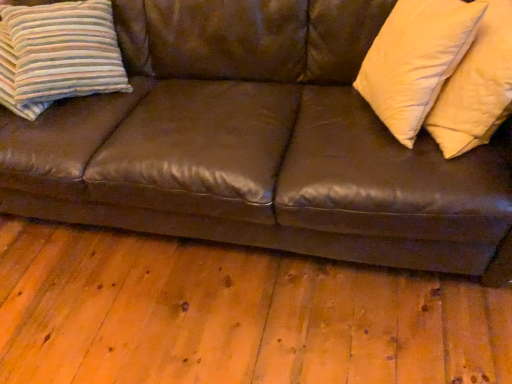
Question: Is soft yellow pillow at right, the third pillow from the left, positioned in front of striped fabric pillow at left, which ranks as the 1th pillow in left-to-right order?

Choices:
 (A) no
 (B) yes

Answer: (B)

Question: Is soft yellow pillow at right, which is counted as the 1th pillow, starting from the right, at the right side of striped fabric pillow at left, acting as the third pillow starting from the right?

Choices:
 (A) no
 (B) yes

Answer: (B)

Question: Considering the relative sizes of soft yellow pillow at right, which is counted as the 1th pillow, starting from the right, and striped fabric pillow at left, which ranks as the 1th pillow in left-to-right order, in the image provided, is soft yellow pillow at right, which is counted as the 1th pillow, starting from the right, wider than striped fabric pillow at left, which ranks as the 1th pillow in left-to-right order,?

Choices:
 (A) no
 (B) yes

Answer: (A)

Question: Is soft yellow pillow at right, the third pillow from the left, smaller than striped fabric pillow at left, acting as the third pillow starting from the right?

Choices:
 (A) yes
 (B) no

Answer: (B)

Question: Considering the relative positions of soft yellow pillow at right, which is counted as the 1th pillow, starting from the right, and striped fabric pillow at left, which ranks as the 1th pillow in left-to-right order, in the image provided, is soft yellow pillow at right, which is counted as the 1th pillow, starting from the right, to the left of striped fabric pillow at left, which ranks as the 1th pillow in left-to-right order, from the viewer's perspective?

Choices:
 (A) no
 (B) yes

Answer: (A)

Question: From the image's perspective, is soft cream pillow at right, placed as the second pillow when sorted from right to left, located above or below striped fabric pillow at left, acting as the third pillow starting from the right?

Choices:
 (A) above
 (B) below

Answer: (B)

Question: From a real-world perspective, is soft cream pillow at right, placed as the second pillow when sorted from right to left, positioned above or below striped fabric pillow at left, acting as the third pillow starting from the right?

Choices:
 (A) above
 (B) below

Answer: (A)

Question: Does point click(375, 102) appear closer or farther from the camera than point click(31, 109)?

Choices:
 (A) closer
 (B) farther

Answer: (A)

Question: In the image, is soft cream pillow at right, placed as the second pillow when sorted from right to left, on the left side or the right side of striped fabric pillow at left, acting as the third pillow starting from the right?

Choices:
 (A) right
 (B) left

Answer: (A)

Question: Is soft yellow pillow at right, which is counted as the 1th pillow, starting from the right, in front of or behind soft cream pillow at right, which is the second pillow in left-to-right order, in the image?

Choices:
 (A) front
 (B) behind

Answer: (A)

Question: From the image's perspective, is soft yellow pillow at right, which is counted as the 1th pillow, starting from the right, positioned above or below soft cream pillow at right, placed as the second pillow when sorted from right to left?

Choices:
 (A) above
 (B) below

Answer: (B)

Question: Considering the positions of soft yellow pillow at right, the third pillow from the left, and soft cream pillow at right, placed as the second pillow when sorted from right to left, in the image, is soft yellow pillow at right, the third pillow from the left, taller or shorter than soft cream pillow at right, placed as the second pillow when sorted from right to left,?

Choices:
 (A) short
 (B) tall

Answer: (B)

Question: Is soft yellow pillow at right, the third pillow from the left, bigger or smaller than soft cream pillow at right, placed as the second pillow when sorted from right to left?

Choices:
 (A) big
 (B) small

Answer: (A)

Question: Is striped fabric pillow at left, acting as the third pillow starting from the right, wider or thinner than brown leather couch at center?

Choices:
 (A) thin
 (B) wide

Answer: (A)

Question: Visually, is striped fabric pillow at left, acting as the third pillow starting from the right, positioned to the left or to the right of brown leather couch at center?

Choices:
 (A) right
 (B) left

Answer: (B)